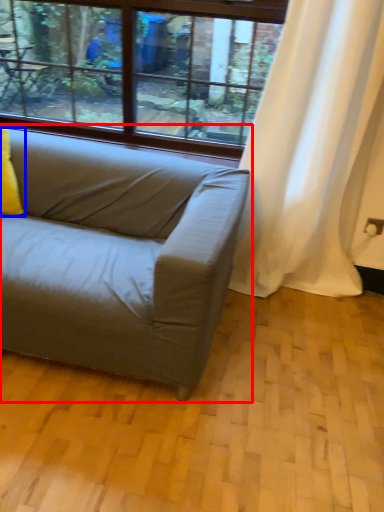
Question: Among these objects, which one is nearest to the camera, studio couch (highlighted by a red box) or pillow (highlighted by a blue box)?

Choices:
 (A) studio couch
 (B) pillow

Answer: (A)